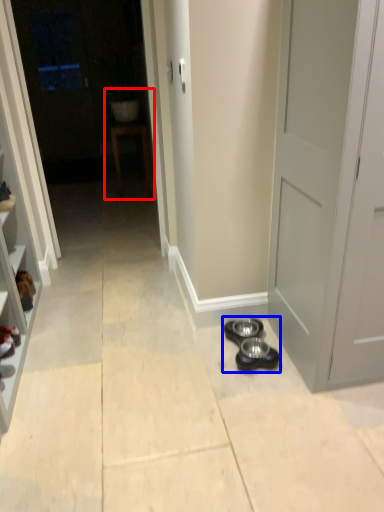
Question: Which of the following is the farthest to the observer, sink (highlighted by a red box) or shoe (highlighted by a blue box)?

Choices:
 (A) sink
 (B) shoe

Answer: (A)